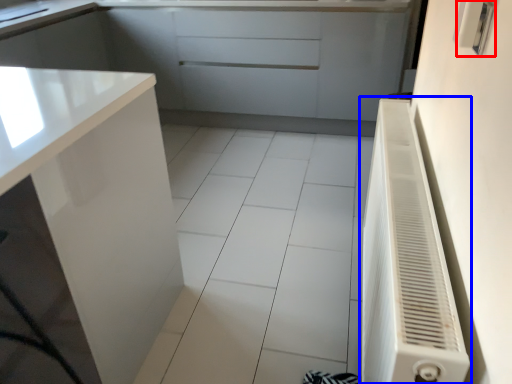
Question: Among these objects, which one is farthest to the camera, electric outlet (highlighted by a red box) or air conditioner (highlighted by a blue box)?

Choices:
 (A) electric outlet
 (B) air conditioner

Answer: (A)